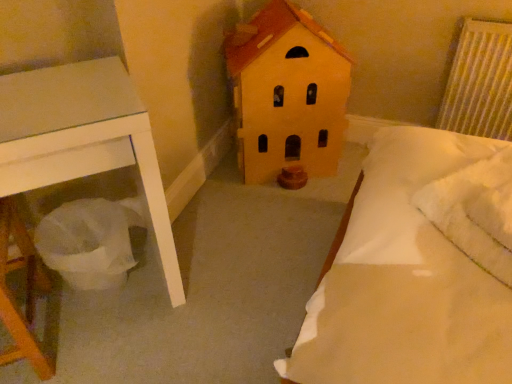
The image size is (512, 384). I want to click on free spot in front of matte yellow house at center, so click(273, 223).